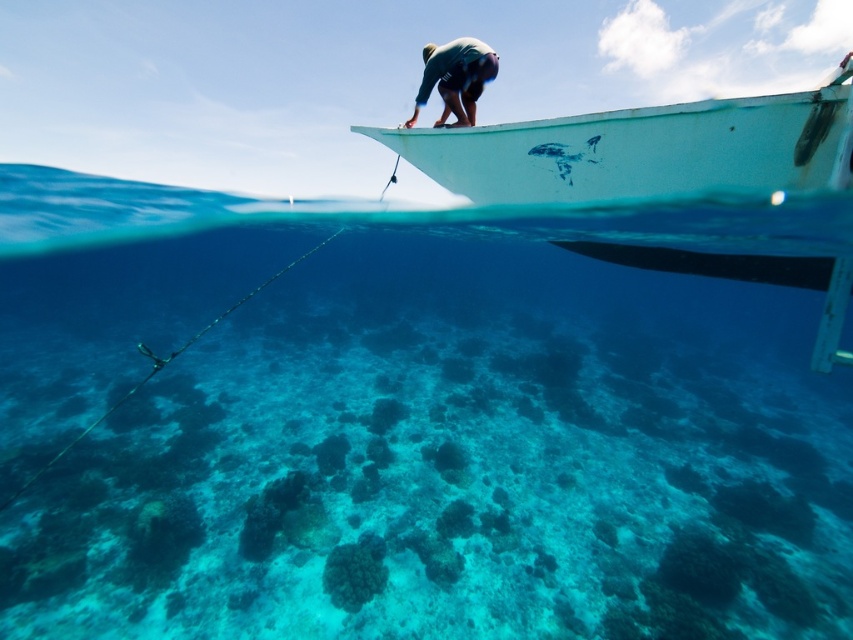
Is point (439, 253) farther from viewer compared to point (416, 97)?

Yes, it is behind point (416, 97).

Can you confirm if clear blue water at center is smaller than dark green wetsuit at upper center?

No.

I want to click on clear blue water at center, so click(410, 422).

Between clear blue water at center and white matte boat at upper right, which one is positioned lower?

white matte boat at upper right is lower down.

At what (x,y) coordinates should I click in order to perform the action: click on clear blue water at center. Please return your answer as a coordinate pair (x, y). Image resolution: width=853 pixels, height=640 pixels. Looking at the image, I should click on point(410,422).

From the picture: Is white matte boat at upper right closer to the viewer compared to dark green wetsuit at upper center?

Yes.

Measure the distance between white matte boat at upper right and dark green wetsuit at upper center.

4.69 feet

Does point (712, 131) lie behind point (473, 84)?

No, it is not.

Find the location of `white matte boat at upper right`. white matte boat at upper right is located at coordinates (643, 148).